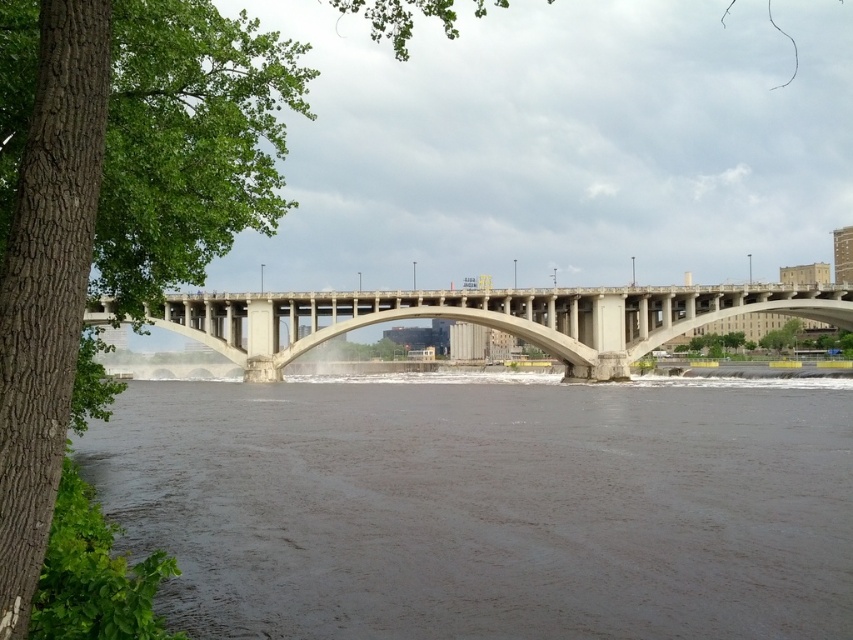
You are a boat captain trying to navigate through the river shown in the image. You need to avoid shallow areas. The coordinates provided in the Objects Description indicate the exact location of the brown muddy water at center. If the coordinates are given as a point, does this mean the shallow area is a single spot or a larger region? Please explain based on the scene description.

The coordinates provided for the brown muddy water at center are a single point, which suggests the shallow area is a specific spot rather than a larger region. However, the scene description mentions the river has a dark brownish hue due to sediment, implying possible wider shallow areas. Further inspection would be needed for precise navigation.

You are a boat captain planning to navigate a 25 meter long vessel through the river shown in the image. The vessel requires a minimum of 2 meters of clearance between its stern and any obstacles. Can you safely pass under the concrete bridge at center while maintaining the required clearance with the brown muddy water at center?

The brown muddy water at center and concrete bridge at center are 26.49 meters apart from each other. Since the vessel is 25 meters long and requires 2 meters of clearance, the total needed space is 27 meters. However, the available space between them is only 26.49 meters, so it is not safe to pass under the concrete bridge at center while maintaining the required clearance with the brown muddy water at center.

You are a photographer standing at the riverside. You want to capture a closeup shot of the brown muddy water at center. Given that your camera can focus on objects within 50 meters, will you be able to take the photo without moving closer?

The brown muddy water at center is 77.64 meters away from the camera. Since your camera can only focus on objects within 50 meters, you will need to move closer to take the closeup shot.